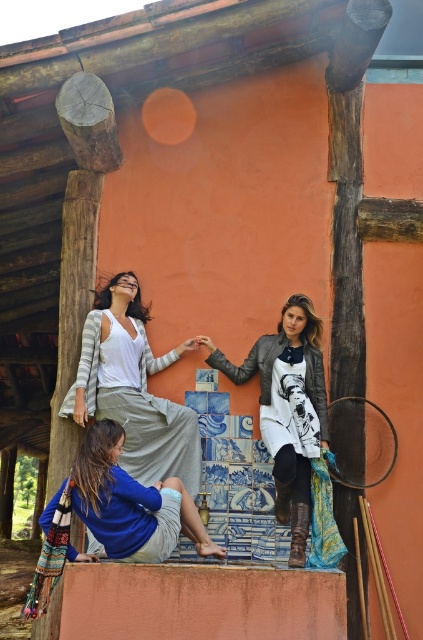
You are organizing a charity clothing drive and need to determine which items can fit into a donation box that has a capacity of 1.2 cubic feet. Given the sizes of the leather jacket at center and the blue cotton shirt at lower left, which item is more likely to fit inside the box?

The blue cotton shirt at lower left is smaller in size compared to the leather jacket at center, so it is more likely to fit inside the donation box with a capacity of 1.2 cubic feet.

You are organizing a clothing display and need to arrange the leather jacket at center and the blue cotton shirt at lower left on a rack. Which item should you place higher up to ensure proper visibility?

The leather jacket at center should be placed higher up since it is taller than the blue cotton shirt at lower left, ensuring both items are visible without one blocking the other.

You are standing at the origin point of the image. You want to place a new object at a position that is exactly 0.2 units to the right and 0.3 units above the point labeled as point (x=288, y=408). What are the coordinates of the new position?

The new coordinates would be calculated by adding 0.2 to the x coordinate and 0.3 to the y coordinate of point (x=288, y=408). The new position is at point 0.839, 0.981.